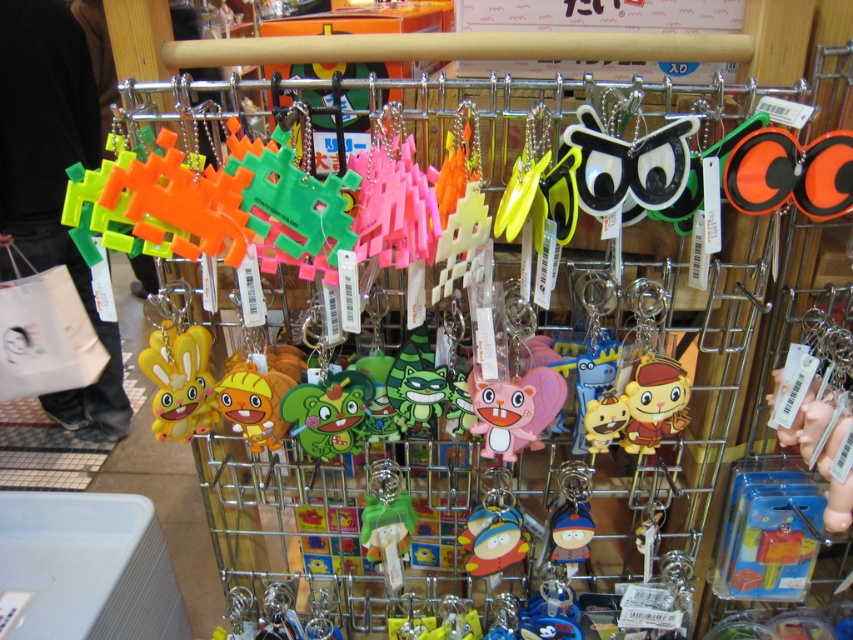
Can you confirm if neon plastic keychains at left is positioned to the left of yellow matte rabbit at left?

Correct, you'll find neon plastic keychains at left to the left of yellow matte rabbit at left.

Between point (45, 179) and point (184, 371), which one is positioned behind?

Positioned behind is point (45, 179).

Locate an element on the screen. Image resolution: width=853 pixels, height=640 pixels. neon plastic keychains at left is located at coordinates (51, 179).

Can you confirm if yellow matte rabbit at left is positioned to the left of pink rubber keychain at center?

Indeed, yellow matte rabbit at left is positioned on the left side of pink rubber keychain at center.

Which is in front, point (154, 394) or point (503, 413)?

Point (503, 413) is in front.

You are a GUI agent. You are given a task and a screenshot of the screen. Output one action in this format:
    pyautogui.click(x=<x>, y=<y>)
    Task: Click on the yellow matte rabbit at left
    This screenshot has width=853, height=640.
    Given the screenshot: What is the action you would take?
    pyautogui.click(x=180, y=384)

Is neon plastic keychains at left thinner than pink rubber keychain at center?

No.

Looking at this image, who is positioned more to the right, neon plastic keychains at left or pink rubber keychain at center?

From the viewer's perspective, pink rubber keychain at center appears more on the right side.

You are a GUI agent. You are given a task and a screenshot of the screen. Output one action in this format:
    pyautogui.click(x=<x>, y=<y>)
    Task: Click on the neon plastic keychains at left
    Image resolution: width=853 pixels, height=640 pixels.
    Given the screenshot: What is the action you would take?
    pyautogui.click(x=51, y=179)

I want to click on neon plastic keychains at left, so click(51, 179).